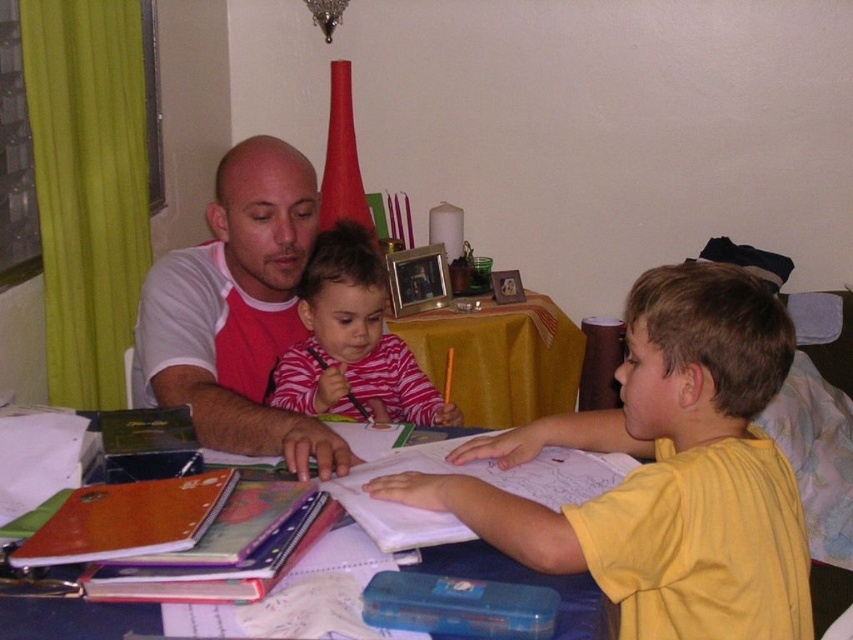
Is point (811, 625) positioned in front of point (283, 388)?

Yes, point (811, 625) is in front of point (283, 388).

The width and height of the screenshot is (853, 640). In order to click on yellow matte shirt at center in this screenshot , I will do `click(664, 472)`.

Is white/red raglan shirt at center smaller than blue plastic table at center?

Incorrect, white/red raglan shirt at center is not smaller in size than blue plastic table at center.

The width and height of the screenshot is (853, 640). Find the location of `white/red raglan shirt at center`. white/red raglan shirt at center is located at coordinates (236, 312).

Is white/red raglan shirt at center above striped cotton shirt at center?

No, white/red raglan shirt at center is not above striped cotton shirt at center.

This screenshot has width=853, height=640. Identify the location of white/red raglan shirt at center. (236, 312).

Where is `white/red raglan shirt at center`? The width and height of the screenshot is (853, 640). white/red raglan shirt at center is located at coordinates (236, 312).